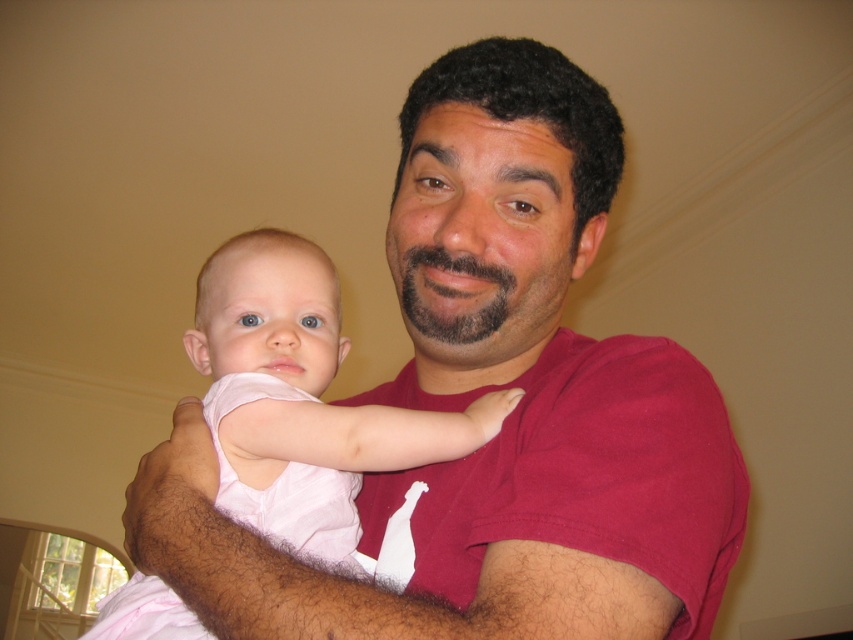
You are designing a photo frame that needs to accommodate both the matte red shirt at center and the pink fabric baby at center in the image. Given that the frame has a fixed width, which object should be prioritized to fit entirely within the frame first?

The matte red shirt at center has a larger width than the pink fabric baby at center, so the frame should prioritize fitting the matte red shirt at center first to ensure it accommodates the wider object.

You are a photographer adjusting the lighting for a closeup shot of the matte red shirt at center and the pink fabric baby at center. You need to ensure that both subjects are evenly lit. Since the two subjects are 3.83 inches apart, will you need to adjust the lighting intensity for one of them to achieve even illumination?

The matte red shirt at center and pink fabric baby at center are 3.83 inches apart from each other. Since they are close in proximity, you may not need to adjust the lighting intensity significantly for either subject to achieve even illumination.

You are standing in front of the scene and want to touch both points. Which point should you reach for first, point (386, 516) or point (537, 378)?

You should reach for point (386, 516) first because it is closer to you than point (537, 378).